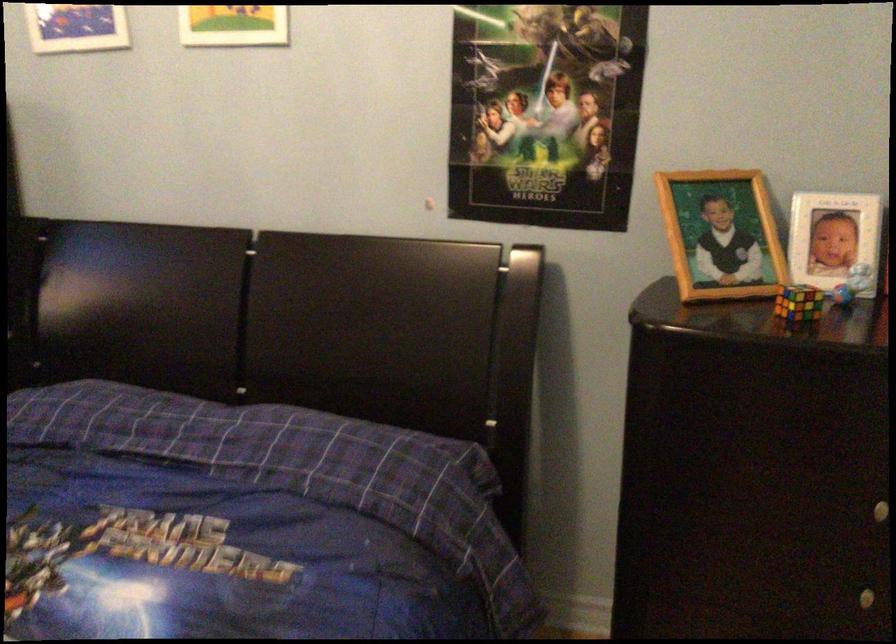
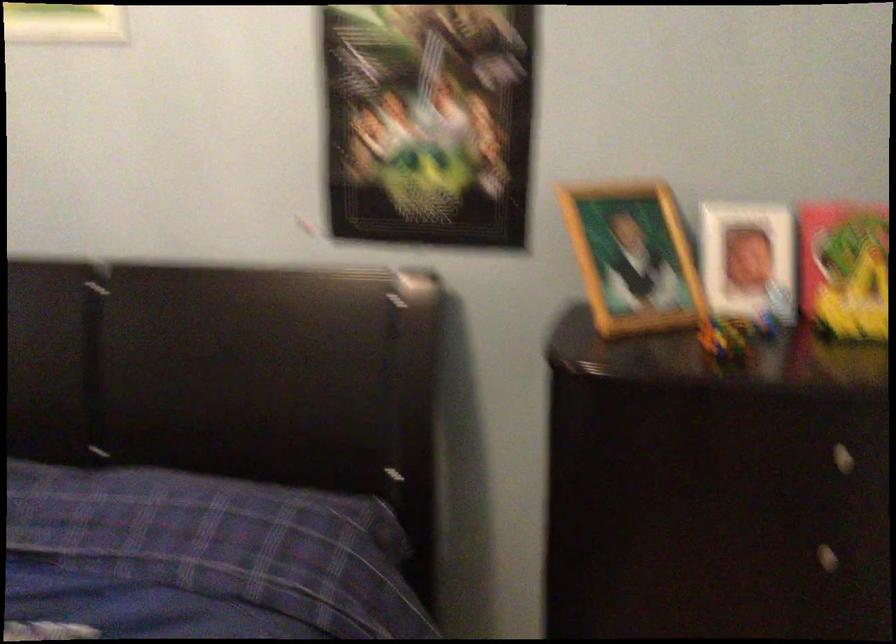
Question: The images are taken continuously from a first-person perspective. In which direction is your viewpoint rotating?

Choices:
 (A) Left
 (B) Right
 (C) Up
 (D) Down

Answer: (B)